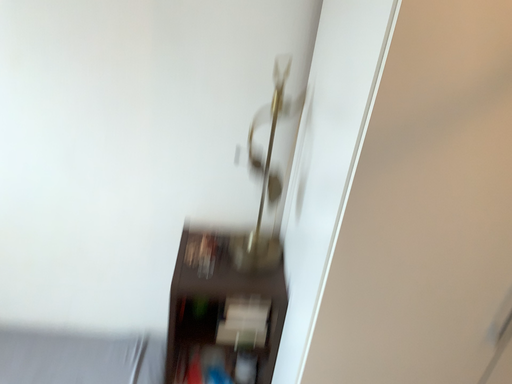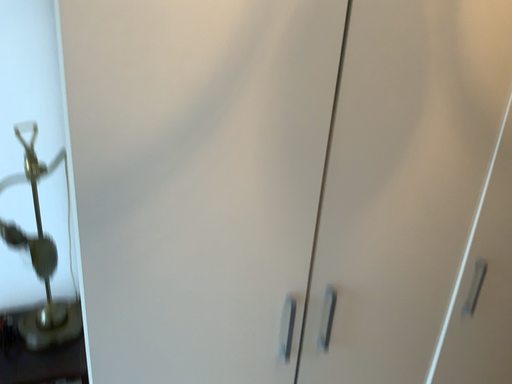
Question: Which way did the camera rotate in the video?

Choices:
 (A) rotated downward
 (B) rotated upward

Answer: (B)